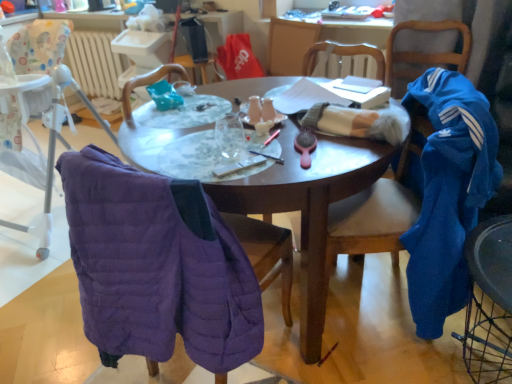
The image size is (512, 384). Find the location of `beige radiator at upper left`. beige radiator at upper left is located at coordinates (95, 63).

In order to face white fuzzy blanket at center, which is the 1th clothing in left-to-right order, should I rotate leftwards or rightwards?

To face it directly, rotate right by 12.970 degrees.

Describe the element at coordinates (360, 122) in the screenshot. I see `white fuzzy blanket at center, which is the second clothing from right to left` at that location.

Describe the element at coordinates (165, 265) in the screenshot. This screenshot has height=384, width=512. I see `purple quilted jacket at left, the 4th chair in the right-to-left sequence` at that location.

What do you see at coordinates (446, 192) in the screenshot? The width and height of the screenshot is (512, 384). I see `blue fleece jacket at right, placed as the 2th clothing when sorted from left to right` at bounding box center [446, 192].

Locate an element on the screen. velvet blue chair at right, which ranks as the 2th chair in right-to-left order is located at coordinates (489, 302).

Where is `blue fleece jacket at right, positioned as the third chair in right-to-left order`? blue fleece jacket at right, positioned as the third chair in right-to-left order is located at coordinates (446, 192).

What do you see at coordinates (238, 58) in the screenshot? I see `red fabric bag at center` at bounding box center [238, 58].

Identify the location of beige radiator at upper left. The width and height of the screenshot is (512, 384). (95, 63).

Considering the relative sizes of purple quilted vest at left, acting as the 1th chair starting from the left, and blue fleece jacket at right, the third chair viewed from the left, in the image provided, is purple quilted vest at left, acting as the 1th chair starting from the left, shorter than blue fleece jacket at right, the third chair viewed from the left,?

In fact, purple quilted vest at left, acting as the 1th chair starting from the left, may be taller than blue fleece jacket at right, the third chair viewed from the left.

From the blue fleece jacket at right, positioned as the third chair in right-to-left order, count the 2nd chair to the left and point to it. Please provide its 2D coordinates.

[(34, 138)]

From the image's perspective, is blue fleece jacket at right, placed as the 2th clothing when sorted from left to right, located above or below wooden table at center?

From the image's perspective, blue fleece jacket at right, placed as the 2th clothing when sorted from left to right, appears above wooden table at center.

Is blue fleece jacket at right, placed as the 2th clothing when sorted from left to right, next to wooden table at center?

No, blue fleece jacket at right, placed as the 2th clothing when sorted from left to right, is not with wooden table at center.

Considering the positions of point (422, 88) and point (253, 89), is point (422, 88) closer or farther from the camera than point (253, 89)?

Clearly, point (422, 88) is closer to the camera than point (253, 89).

Is blue fleece jacket at right, the first clothing positioned from the right, taller than wooden table at center?

Yes, blue fleece jacket at right, the first clothing positioned from the right, is taller than wooden table at center.

Consider the image. From a real-world perspective, is purple quilted vest at left, acting as the 1th chair starting from the left, physically located above or below blue fleece jacket at right, placed as the 1th chair when sorted from right to left?

purple quilted vest at left, acting as the 1th chair starting from the left, is below blue fleece jacket at right, placed as the 1th chair when sorted from right to left.

Can you confirm if purple quilted vest at left, acting as the 1th chair starting from the left, is smaller than blue fleece jacket at right, placed as the 1th chair when sorted from right to left?

Result: No.

Measure the distance from purple quilted vest at left, which appears as the 5th chair when viewed from the right, to blue fleece jacket at right, placed as the 1th chair when sorted from right to left.

1.97 meters.

Does purple quilted vest at left, acting as the 1th chair starting from the left, turn towards blue fleece jacket at right, placed as the 1th chair when sorted from right to left?

No, purple quilted vest at left, acting as the 1th chair starting from the left, is not aimed at blue fleece jacket at right, placed as the 1th chair when sorted from right to left.

Is white fuzzy blanket at center, which is the 1th clothing in left-to-right order, looking in the opposite direction of red fabric bag at center?

No, red fabric bag at center is not at the back of white fuzzy blanket at center, which is the 1th clothing in left-to-right order.

Would you say white fuzzy blanket at center, which is the 1th clothing in left-to-right order, is outside red fabric bag at center?

Yes, white fuzzy blanket at center, which is the 1th clothing in left-to-right order, is outside of red fabric bag at center.

Measure the distance from white fuzzy blanket at center, which is the 1th clothing in left-to-right order, to red fabric bag at center.

The distance of white fuzzy blanket at center, which is the 1th clothing in left-to-right order, from red fabric bag at center is 1.55 meters.

Find the location of a particular element. The image size is (512, 384). clothing that is the 1st one when counting downward from the red fabric bag at center (from the image's perspective) is located at coordinates (360, 122).

How far apart are blue fleece jacket at right, the first clothing positioned from the right, and white fuzzy blanket at center, which is the 1th clothing in left-to-right order?

blue fleece jacket at right, the first clothing positioned from the right, and white fuzzy blanket at center, which is the 1th clothing in left-to-right order, are 30.59 centimeters apart from each other.

Does blue fleece jacket at right, the first clothing positioned from the right, contain white fuzzy blanket at center, which is the second clothing from right to left?

No, white fuzzy blanket at center, which is the second clothing from right to left, is not inside blue fleece jacket at right, the first clothing positioned from the right.

Which is more to the right, blue fleece jacket at right, placed as the 2th clothing when sorted from left to right, or white fuzzy blanket at center, which is the 1th clothing in left-to-right order?

blue fleece jacket at right, placed as the 2th clothing when sorted from left to right, is more to the right.

Which object is wider, blue fleece jacket at right, the first clothing positioned from the right, or white fuzzy blanket at center, which is the second clothing from right to left?

blue fleece jacket at right, the first clothing positioned from the right, is wider.

Can you confirm if matte black pen at center is taller than purple quilted jacket at left, the 4th chair in the right-to-left sequence?

In fact, matte black pen at center may be shorter than purple quilted jacket at left, the 4th chair in the right-to-left sequence.

Between point (270, 157) and point (115, 284), which one is positioned in front?

Point (115, 284)

Where is `pen above the purple quilted jacket at left, which is counted as the 2th chair, starting from the left (from a real-world perspective)`? The height and width of the screenshot is (384, 512). pen above the purple quilted jacket at left, which is counted as the 2th chair, starting from the left (from a real-world perspective) is located at coordinates (268, 156).

Considering the relative positions of matte black pen at center and purple quilted jacket at left, which is counted as the 2th chair, starting from the left, in the image provided, is matte black pen at center to the left of purple quilted jacket at left, which is counted as the 2th chair, starting from the left, from the viewer's perspective?

Incorrect, matte black pen at center is not on the left side of purple quilted jacket at left, which is counted as the 2th chair, starting from the left.

Is velvet blue chair at right, arranged as the fourth chair when viewed from the left, facing towards beige radiator at upper left?

No, velvet blue chair at right, arranged as the fourth chair when viewed from the left, is not aimed at beige radiator at upper left.

Which is less distant, (486,360) or (106,71)?

Point (486,360) is closer to the camera than point (106,71).

Considering the relative positions of velvet blue chair at right, arranged as the fourth chair when viewed from the left, and beige radiator at upper left in the image provided, is velvet blue chair at right, arranged as the fourth chair when viewed from the left, to the right of beige radiator at upper left from the viewer's perspective?

Yes.

From a real-world perspective, is velvet blue chair at right, which ranks as the 2th chair in right-to-left order, positioned over beige radiator at upper left based on gravity?

No, from a real-world perspective, velvet blue chair at right, which ranks as the 2th chair in right-to-left order, is not above beige radiator at upper left.

Which chair is the 1st one when counting from the back of the blue fleece jacket at right, the third chair viewed from the left? Please provide its 2D coordinates.

[(34, 138)]

Where is `desk that is on the left side of blue fleece jacket at right, the first clothing positioned from the right`? This screenshot has height=384, width=512. desk that is on the left side of blue fleece jacket at right, the first clothing positioned from the right is located at coordinates (308, 208).

When comparing their distances from purple quilted vest at left, acting as the 1th chair starting from the left, does beige radiator at upper left or matte black pen at center seem closer?

beige radiator at upper left is positioned closer to the anchor purple quilted vest at left, acting as the 1th chair starting from the left.

Considering their positions, is beige radiator at upper left positioned closer to matte black pen at center than wooden table at center?

wooden table at center is closer to matte black pen at center.

In the scene shown: Estimate the real-world distances between objects in this image. Which object is closer to purple quilted jacket at left, the 4th chair in the right-to-left sequence, blue fleece jacket at right, positioned as the third chair in right-to-left order, or wooden table at center?

Based on the image, wooden table at center appears to be nearer to purple quilted jacket at left, the 4th chair in the right-to-left sequence.

Estimate the real-world distances between objects in this image. Which object is further from matte black pen at center, blue fleece jacket at right, the fifth chair in the left-to-right sequence, or purple quilted jacket at left, which is counted as the 2th chair, starting from the left?

The object further to matte black pen at center is blue fleece jacket at right, the fifth chair in the left-to-right sequence.

Which object lies nearer to the anchor point blue fleece jacket at right, positioned as the third chair in right-to-left order, velvet blue chair at right, which ranks as the 2th chair in right-to-left order, or red fabric bag at center?

velvet blue chair at right, which ranks as the 2th chair in right-to-left order, is closer to blue fleece jacket at right, positioned as the third chair in right-to-left order.

Looking at the image, which one is located further to white fuzzy blanket at center, which is the second clothing from right to left, purple quilted jacket at left, the 4th chair in the right-to-left sequence, or blue fleece jacket at right, positioned as the third chair in right-to-left order?

Based on the image, purple quilted jacket at left, the 4th chair in the right-to-left sequence, appears to be further to white fuzzy blanket at center, which is the second clothing from right to left.

Based on their spatial positions, is purple quilted vest at left, acting as the 1th chair starting from the left, or blue fleece jacket at right, the first clothing positioned from the right, further from purple quilted jacket at left, the 4th chair in the right-to-left sequence?

Based on the image, purple quilted vest at left, acting as the 1th chair starting from the left, appears to be further to purple quilted jacket at left, the 4th chair in the right-to-left sequence.

Considering their positions, is red fabric bag at center positioned closer to purple quilted vest at left, which appears as the 5th chair when viewed from the right, than blue fleece jacket at right, positioned as the third chair in right-to-left order?

Among the two, red fabric bag at center is located nearer to purple quilted vest at left, which appears as the 5th chair when viewed from the right.

The height and width of the screenshot is (384, 512). Find the location of `desk located between purple quilted vest at left, acting as the 1th chair starting from the left, and velvet blue chair at right, which ranks as the 2th chair in right-to-left order, in the left-right direction`. desk located between purple quilted vest at left, acting as the 1th chair starting from the left, and velvet blue chair at right, which ranks as the 2th chair in right-to-left order, in the left-right direction is located at coordinates (308, 208).

The width and height of the screenshot is (512, 384). I want to click on handbag positioned between velvet blue chair at right, arranged as the fourth chair when viewed from the left, and beige radiator at upper left from near to far, so click(x=238, y=58).

Where is `chair situated between purple quilted vest at left, which appears as the 5th chair when viewed from the right, and blue fleece jacket at right, the third chair viewed from the left, from left to right`? This screenshot has width=512, height=384. chair situated between purple quilted vest at left, which appears as the 5th chair when viewed from the right, and blue fleece jacket at right, the third chair viewed from the left, from left to right is located at coordinates (165, 265).

What are the coordinates of `pen situated between purple quilted vest at left, which appears as the 5th chair when viewed from the right, and blue fleece jacket at right, placed as the 1th chair when sorted from right to left, from left to right` in the screenshot? It's located at (268, 156).